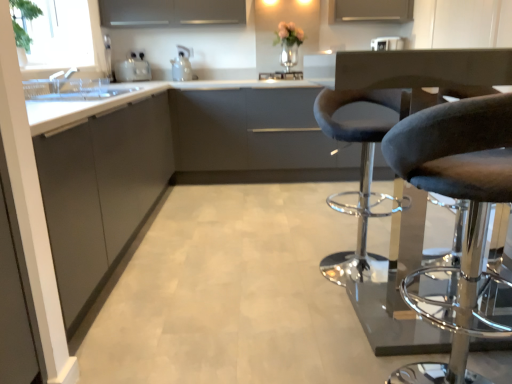
Question: In terms of size, does matte gray cabinet at center, the 2th cabinetry positioned from the back, appear bigger or smaller than white glossy toaster at upper center, marked as the third appliance in a left-to-right arrangement?

Choices:
 (A) big
 (B) small

Answer: (A)

Question: Based on their positions, is matte gray cabinet at center, arranged as the 2th cabinetry when viewed from the front, located to the left or right of white glossy toaster at upper center, the 1th appliance viewed from the right?

Choices:
 (A) left
 (B) right

Answer: (A)

Question: Which object is the closest to the gray fabric swivel chair at right?

Choices:
 (A) matte gray cabinet at center, the 2th cabinetry positioned from the back
 (B) satin silver toaster at left, which ranks as the first appliance in left-to-right order
 (C) dark gray fabric stool at right
 (D) white glossy toaster at upper center, the 1th appliance viewed from the right
 (E) matte gray cabinet at upper center, marked as the 3th cabinetry in a front-to-back arrangement

Answer: (C)

Question: Which object is positioned farthest from the matte gray cabinet at left, acting as the 3th cabinetry starting from the back?

Choices:
 (A) satin silver toaster at left, placed as the third appliance when sorted from right to left
 (B) dark gray fabric stool at right
 (C) matte gray cabinet at center, the 2th cabinetry positioned from the back
 (D) gray fabric swivel chair at right
 (E) satin silver sink at center, the 2th appliance viewed from the left

Answer: (E)